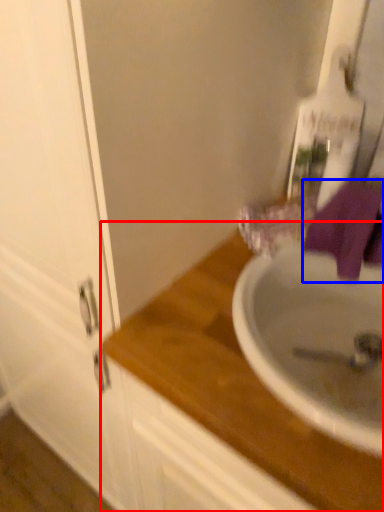
Question: Which of the following is the closest to the observer, countertop (highlighted by a red box) or bath towel (highlighted by a blue box)?

Choices:
 (A) countertop
 (B) bath towel

Answer: (A)